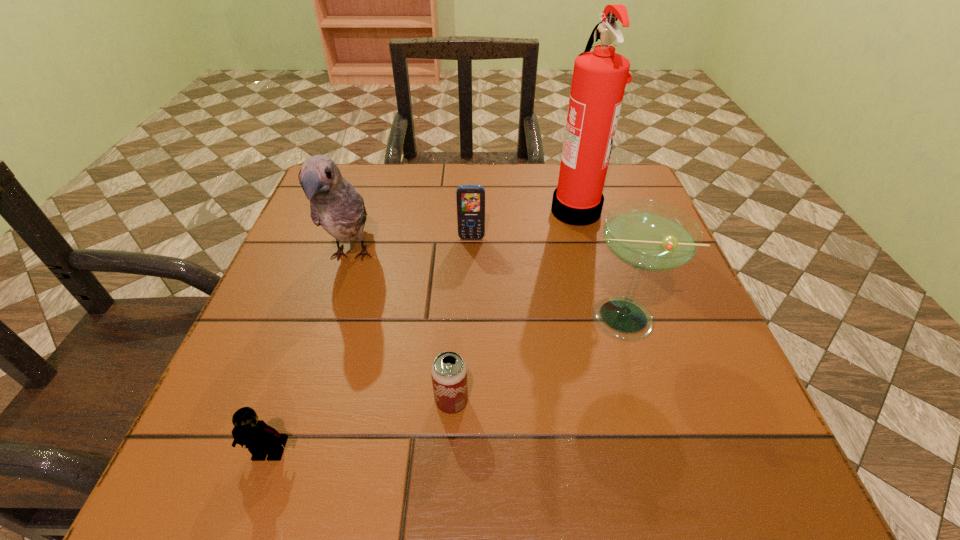
The width and height of the screenshot is (960, 540). Identify the location of object that is at the far right corner. (599, 79).

Image resolution: width=960 pixels, height=540 pixels. Identify the location of vacant space at the far edge. (516, 195).

Locate an element on the screen. The height and width of the screenshot is (540, 960). vacant space at the near edge of the desktop is located at coordinates (462, 455).

The width and height of the screenshot is (960, 540). I want to click on blank space at the left edge, so click(x=324, y=310).

This screenshot has width=960, height=540. I want to click on free space at the far left corner, so click(367, 185).

Locate an element on the screen. free spot between the fourth shortest object and the cellular telephone is located at coordinates (544, 278).

Where is `vacant area that lies between the fourth tallest object and the third tallest object`? This screenshot has height=540, width=960. vacant area that lies between the fourth tallest object and the third tallest object is located at coordinates (544, 278).

Identify the location of empty location between the fire extinguisher and the Lego. This screenshot has height=540, width=960. (422, 331).

This screenshot has width=960, height=540. Identify the location of vacant space that's between the third tallest object and the tallest object. (597, 264).

At what (x,y) coordinates should I click in order to perform the action: click on free space between the parrot and the cellular telephone. Please return your answer as a coordinate pair (x, y). The image size is (960, 540). Looking at the image, I should click on (411, 248).